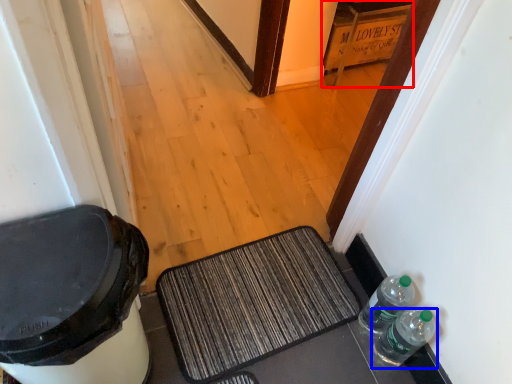
Question: Which object appears farthest to the camera in this image, cabinetry (highlighted by a red box) or bottle (highlighted by a blue box)?

Choices:
 (A) cabinetry
 (B) bottle

Answer: (A)